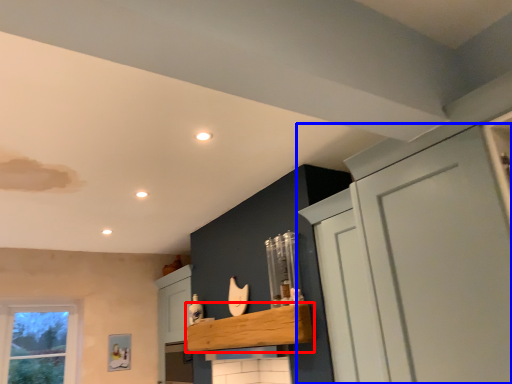
Question: Which object is further to the camera taking this photo, cabinetry (highlighted by a red box) or cupboard (highlighted by a blue box)?

Choices:
 (A) cabinetry
 (B) cupboard

Answer: (A)